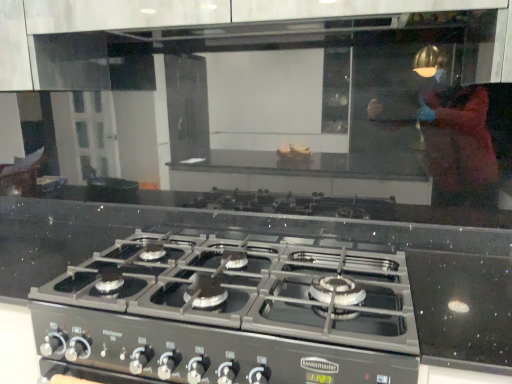
I want to click on satin black gas stove at center, so click(249, 288).

Describe the element at coordinates (249, 288) in the screenshot. The height and width of the screenshot is (384, 512). I see `satin black gas stove at center` at that location.

I want to click on satin black gas stove at center, so click(249, 288).